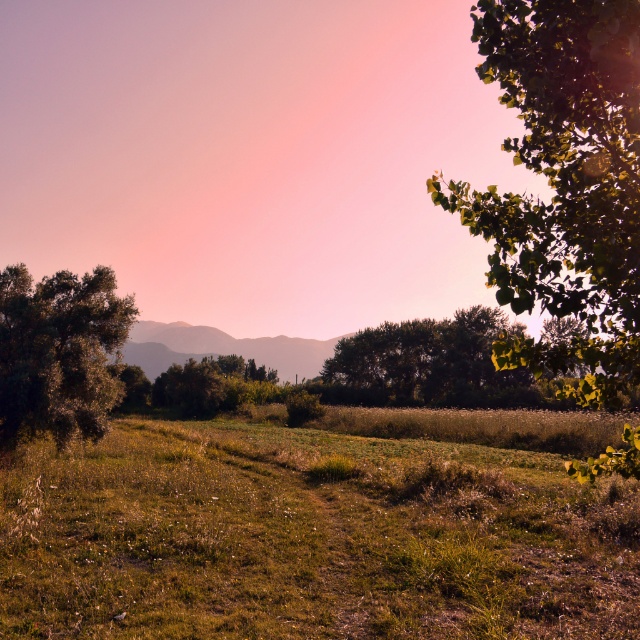
Is green grassy field at center further to the viewer compared to rustic brown hillside at center?

No.

Who is shorter, green grassy field at center or rustic brown hillside at center?

With less height is green grassy field at center.

Where is `green grassy field at center`? The image size is (640, 640). green grassy field at center is located at coordinates (308, 538).

Where is `green grassy field at center`? This screenshot has width=640, height=640. green grassy field at center is located at coordinates (308, 538).

Is green leafy tree at right above green leafy tree at left?

Yes, green leafy tree at right is above green leafy tree at left.

Can you confirm if green leafy tree at right is bigger than green leafy tree at left?

Indeed, green leafy tree at right has a larger size compared to green leafy tree at left.

Is point (560, 236) positioned after point (52, 308)?

No, it is in front of (52, 308).

The width and height of the screenshot is (640, 640). In order to click on green leafy tree at right in this screenshot , I will do `click(564, 186)`.

Is green grassy field at center shorter than green leafy tree at right?

Yes.

Is point (461, 618) behind point (580, 212)?

Yes.

Which is in front, point (3, 604) or point (481, 48)?

Point (481, 48)

Where is `green grassy field at center`? Image resolution: width=640 pixels, height=640 pixels. green grassy field at center is located at coordinates (308, 538).